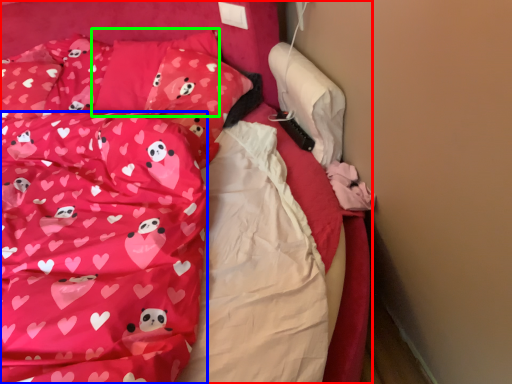
Question: Estimate the real-world distances between objects in this image. Which object is closer to bed (highlighted by a red box), blanket (highlighted by a blue box) or pillow (highlighted by a green box)?

Choices:
 (A) blanket
 (B) pillow

Answer: (B)